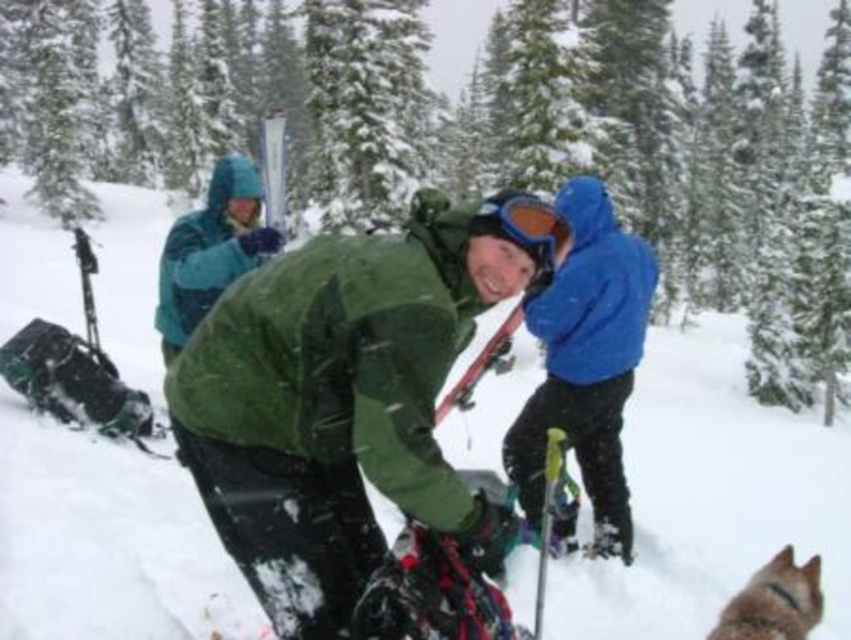
Question: Which point is closer to the camera?

Choices:
 (A) white matte snow at center
 (B) teal fleece jacket at upper left
 (C) brown fur dog at lower right

Answer: (C)

Question: Does teal fleece jacket at upper left have a lesser width compared to matte red ski at center?

Choices:
 (A) yes
 (B) no

Answer: (B)

Question: From the image, what is the correct spatial relationship of white matte snow at center in relation to blue matte jacket at center?

Choices:
 (A) right
 (B) left

Answer: (B)

Question: Which object appears closest to the camera in this image?

Choices:
 (A) teal fleece jacket at upper left
 (B) white matte snow at center
 (C) blue matte jacket at center
 (D) brown fur dog at lower right

Answer: (D)

Question: Which object is positioned farthest from the blue matte jacket at center?

Choices:
 (A) matte red ski at center
 (B) teal fleece jacket at upper left
 (C) brown fur dog at lower right
 (D) metallic silver ski pole at center

Answer: (C)

Question: Does white matte snow at center appear under matte red ski at center?

Choices:
 (A) yes
 (B) no

Answer: (B)